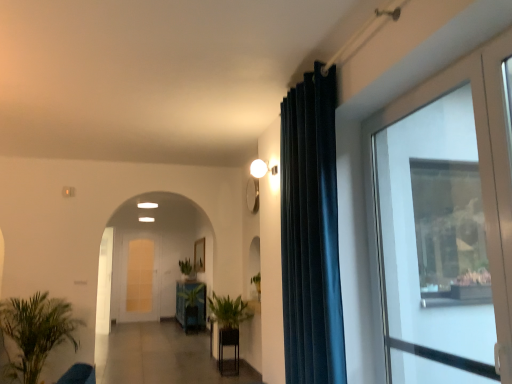
Question: In the image, is dark blue velvet curtain at center positioned in front of or behind wooden frame at center?

Choices:
 (A) front
 (B) behind

Answer: (A)

Question: In terms of width, does dark blue velvet curtain at center look wider or thinner when compared to wooden frame at center?

Choices:
 (A) wide
 (B) thin

Answer: (A)

Question: Which is farther from the dark blue velvet curtain at center?

Choices:
 (A) green leafy plant at lower left, marked as the third houseplant in a right-to-left arrangement
 (B) green leafy plant at center
 (C) transparent glass door at right
 (D) wooden frame at center
 (E) green glossy plant pot at center, the second furniture in the right-to-left sequence

Answer: (D)

Question: Which is nearer to the wooden frame at center?

Choices:
 (A) wooden table at center, placed as the first furniture when sorted from front to back
 (B) green matte plant at center, which is the third houseplant in left-to-right order
 (C) green glossy plant pot at center, acting as the 1th furniture starting from the left
 (D) white glossy door at center, which is the first screen door from front to back
 (E) white glass screen door at center, which is the 2th screen door in front-to-back order

Answer: (C)